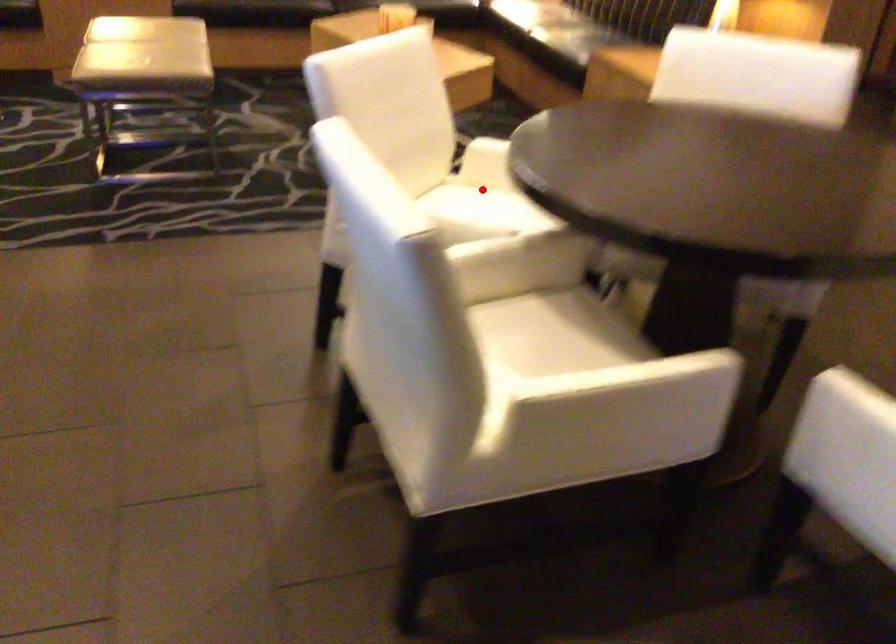
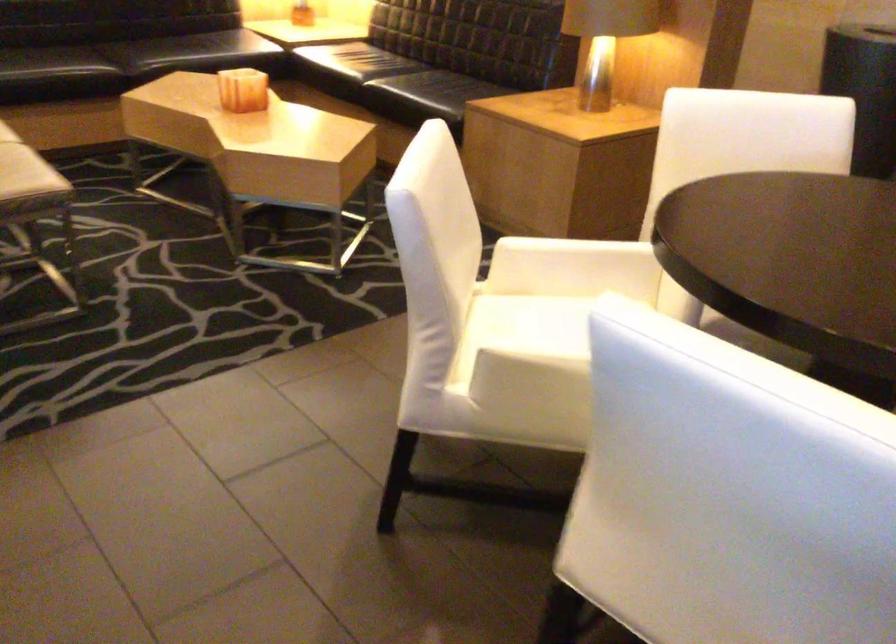
Question: I am providing you with two images of the same scene from different viewpoints. A red point is shown in image1. For the corresponding object point in image2, is it positioned nearer or farther from the camera?

Choices:
 (A) Nearer
 (B) Farther

Answer: (A)